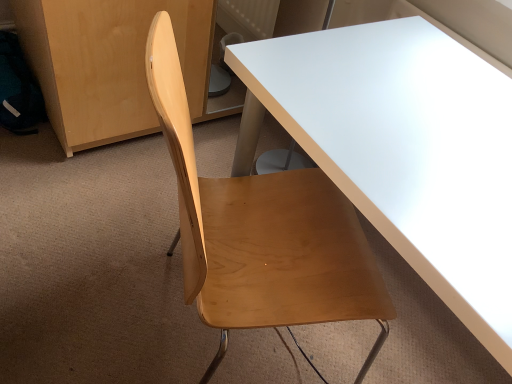
The height and width of the screenshot is (384, 512). Describe the element at coordinates (407, 149) in the screenshot. I see `white glossy table at upper center` at that location.

Identify the location of white glossy table at upper center. The height and width of the screenshot is (384, 512). (407, 149).

At what (x,y) coordinates should I click in order to perform the action: click on white glossy table at upper center. Please return your answer as a coordinate pair (x, y). Looking at the image, I should click on (407, 149).